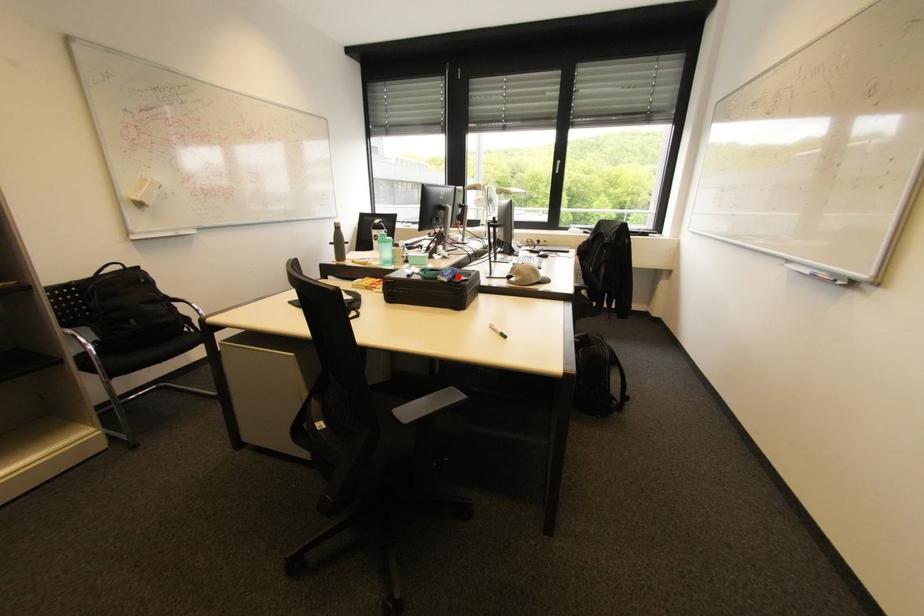
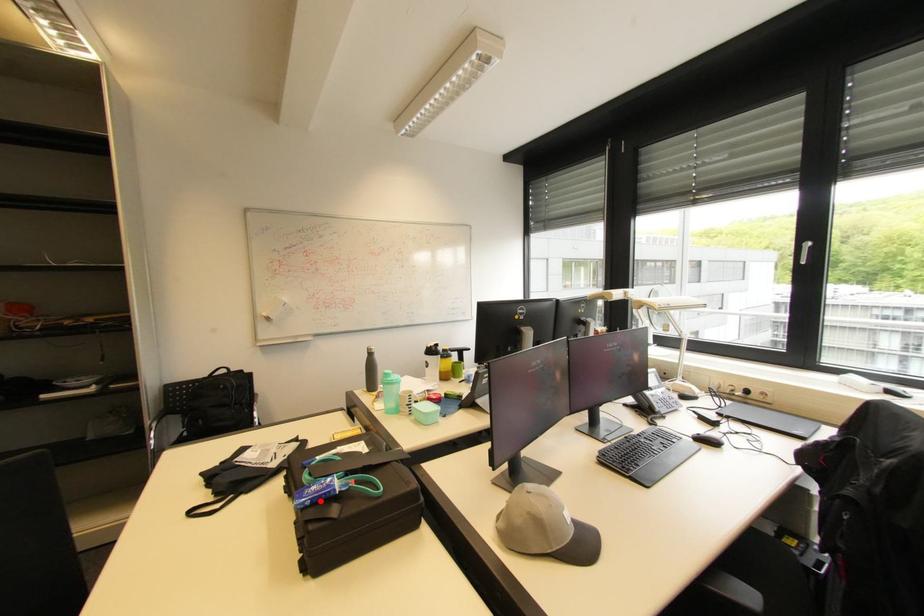
I am providing you with two images of the same scene from different viewpoints. A red point is marked on the first image and another point is marked on the second image. Is the marked point in image1 the same physical position as the marked point in image2?

Yes